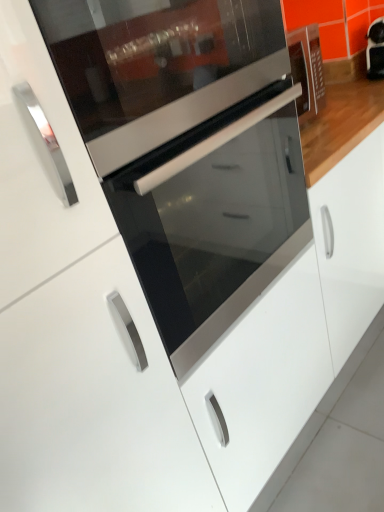
Question: Is glossy white cabinet at center wider than matte black oven at center?

Choices:
 (A) no
 (B) yes

Answer: (B)

Question: Is glossy white cabinet at center with matte black oven at center?

Choices:
 (A) no
 (B) yes

Answer: (A)

Question: Is matte black oven at center located within glossy white cabinet at center?

Choices:
 (A) no
 (B) yes

Answer: (A)

Question: Considering the relative positions of glossy white cabinet at center and matte black oven at center in the image provided, is glossy white cabinet at center in front of matte black oven at center?

Choices:
 (A) no
 (B) yes

Answer: (A)

Question: Considering the relative sizes of glossy white cabinet at center and matte black oven at center in the image provided, is glossy white cabinet at center shorter than matte black oven at center?

Choices:
 (A) yes
 (B) no

Answer: (B)

Question: Looking at their shapes, would you say matte black oven at center is wider or thinner than satin silver oven at center?

Choices:
 (A) thin
 (B) wide

Answer: (B)

Question: From a real-world perspective, is matte black oven at center above or below satin silver oven at center?

Choices:
 (A) below
 (B) above

Answer: (A)

Question: Is point (289, 138) closer or farther from the camera than point (64, 89)?

Choices:
 (A) farther
 (B) closer

Answer: (A)

Question: Is matte black oven at center bigger or smaller than satin silver oven at center?

Choices:
 (A) small
 (B) big

Answer: (B)

Question: Is satin silver oven at center spatially inside matte black oven at center, or outside of it?

Choices:
 (A) inside
 (B) outside

Answer: (B)

Question: In terms of height, does satin silver oven at center look taller or shorter compared to matte black oven at center?

Choices:
 (A) tall
 (B) short

Answer: (B)

Question: Looking at the image, does satin silver oven at center seem bigger or smaller compared to matte black oven at center?

Choices:
 (A) small
 (B) big

Answer: (A)

Question: Considering the positions of point (259, 65) and point (107, 189), is point (259, 65) closer or farther from the camera than point (107, 189)?

Choices:
 (A) farther
 (B) closer

Answer: (A)

Question: Would you say matte black oven at center is to the left or to the right of glossy white cabinet at center in the picture?

Choices:
 (A) left
 (B) right

Answer: (A)

Question: From a real-world perspective, relative to glossy white cabinet at center, is matte black oven at center vertically above or below?

Choices:
 (A) above
 (B) below

Answer: (A)